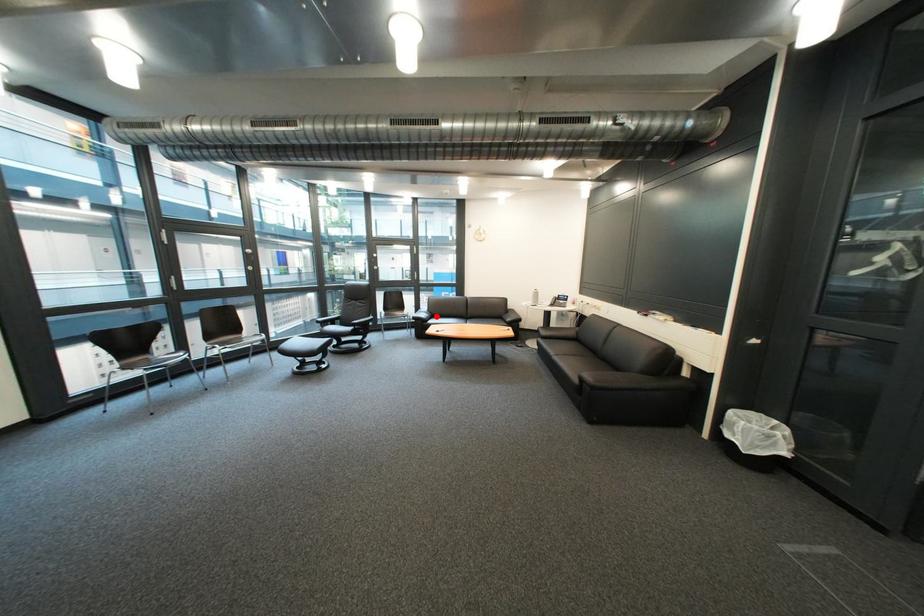
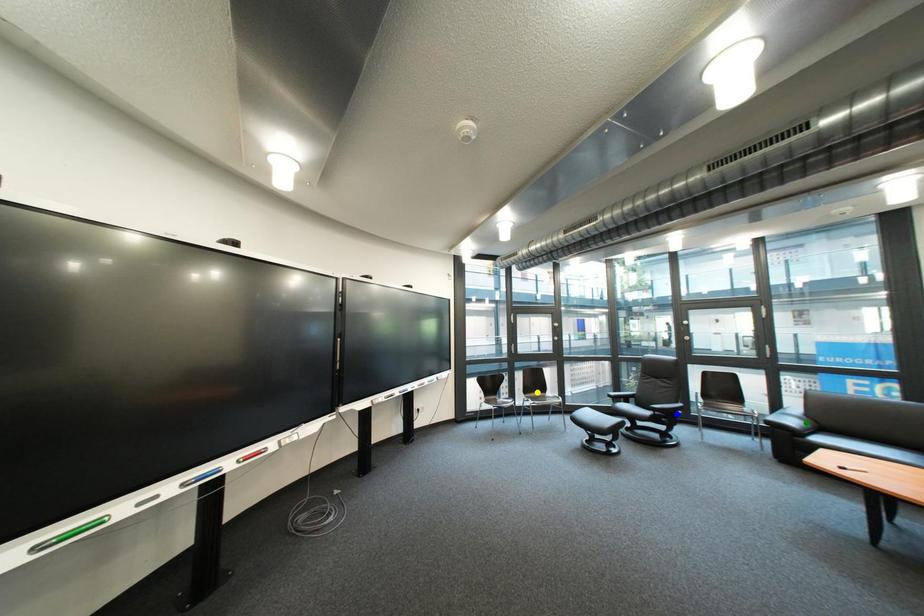
Question: I am providing you with two images of the same scene from different viewpoints. A red point is marked on the first image. You are given multiple points on the second image. Can you choose the point in image 2 that corresponds to the point in image 1?

Choices:
 (A) yellow point
 (B) green point
 (C) blue point

Answer: (B)